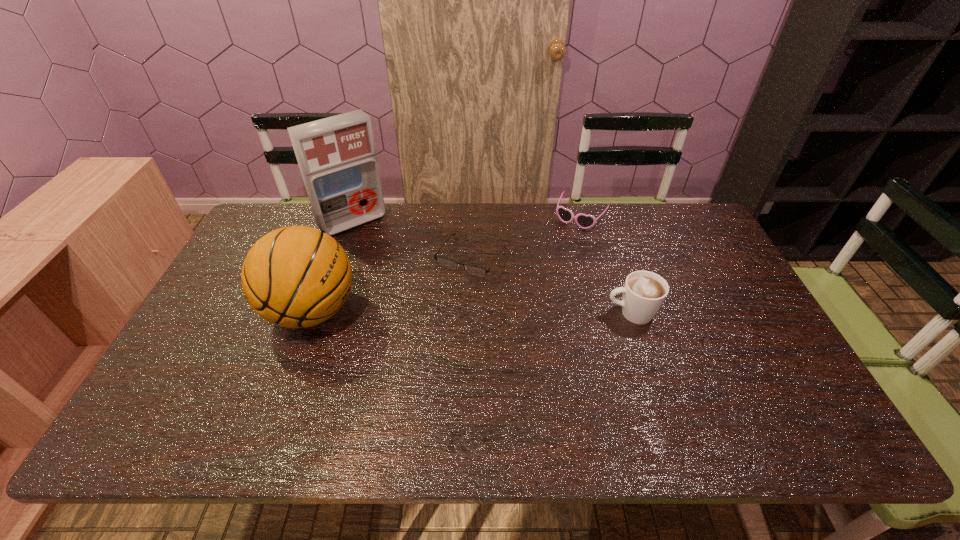
I want to click on vacant space situated 0.050m with the handle on the side of the cappuccino, so click(x=588, y=313).

Identify the location of free space located 0.340m with the handle on the side of the cappuccino. The height and width of the screenshot is (540, 960). (483, 313).

Locate an element on the screen. The height and width of the screenshot is (540, 960). vacant area located 0.280m on the front-facing side of the third object from right to left is located at coordinates (413, 349).

I want to click on vacant region located 0.210m on the front-facing side of the third object from right to left, so click(425, 329).

Where is `vacant region located on the front-facing side of the third object from right to left`? The width and height of the screenshot is (960, 540). vacant region located on the front-facing side of the third object from right to left is located at coordinates (405, 361).

This screenshot has height=540, width=960. Identify the location of blank space located 0.100m on the front-facing side of the fourth tallest object. (560, 246).

What are the coordinates of `vacant region located 0.200m on the front-facing side of the fourth tallest object` in the screenshot? It's located at (547, 265).

Identify the location of vacant space located on the front-facing side of the fourth tallest object. The image size is (960, 540). (560, 246).

What are the coordinates of `free space located 0.310m on the front-facing side of the first-aid kit` in the screenshot? It's located at (413, 291).

At what (x,y) coordinates should I click in order to perform the action: click on vacant space located on the front-facing side of the first-aid kit. Please return your answer as a coordinate pair (x, y). Image resolution: width=960 pixels, height=540 pixels. Looking at the image, I should click on (428, 309).